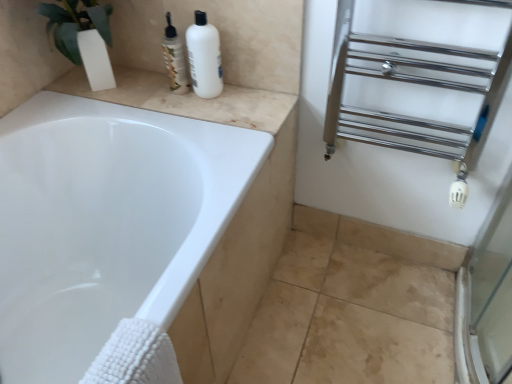
Image resolution: width=512 pixels, height=384 pixels. Find the location of `free location in front of translucent plastic bottles at upper center`. free location in front of translucent plastic bottles at upper center is located at coordinates (184, 107).